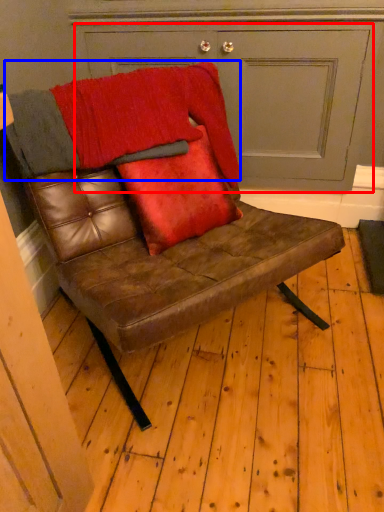
Question: Which object appears closest to the camera in this image, door (highlighted by a red box) or blanket (highlighted by a blue box)?

Choices:
 (A) door
 (B) blanket

Answer: (B)